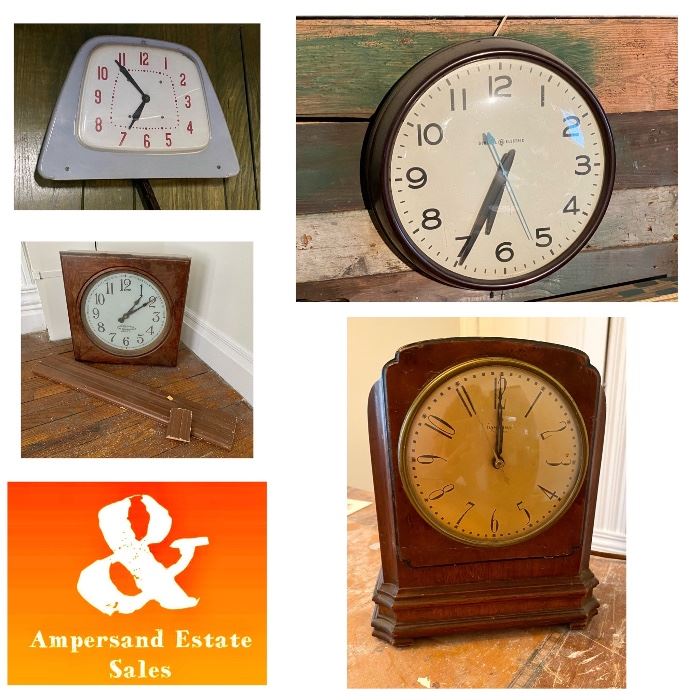
This screenshot has height=700, width=700. I want to click on wall, so point(344,69), point(218,48), point(218,276), point(384,332).